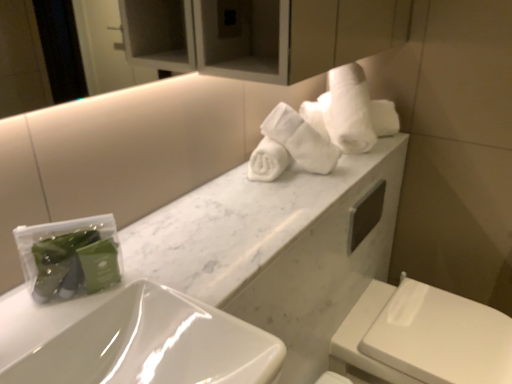
Question: Can you confirm if white soft towel at upper right is taller than white glossy sink at lower left?

Choices:
 (A) no
 (B) yes

Answer: (B)

Question: Considering the relative sizes of white soft towel at upper right and white glossy sink at lower left in the image provided, is white soft towel at upper right wider than white glossy sink at lower left?

Choices:
 (A) no
 (B) yes

Answer: (A)

Question: Does white soft towel at upper right touch white glossy sink at lower left?

Choices:
 (A) no
 (B) yes

Answer: (A)

Question: Is white soft towel at upper right oriented towards white glossy sink at lower left?

Choices:
 (A) yes
 (B) no

Answer: (B)

Question: Is white soft towel at upper right closer to the viewer compared to white glossy sink at lower left?

Choices:
 (A) no
 (B) yes

Answer: (A)

Question: From their relative heights in the image, would you say white glossy toilet at lower right is taller or shorter than white marble countertop at center?

Choices:
 (A) short
 (B) tall

Answer: (B)

Question: Based on their sizes in the image, would you say white glossy toilet at lower right is bigger or smaller than white marble countertop at center?

Choices:
 (A) small
 (B) big

Answer: (B)

Question: From the image's perspective, relative to white marble countertop at center, is white glossy toilet at lower right above or below?

Choices:
 (A) above
 (B) below

Answer: (B)

Question: From a real-world perspective, is white glossy toilet at lower right positioned above or below white marble countertop at center?

Choices:
 (A) below
 (B) above

Answer: (A)

Question: In terms of width, does white soft towel at upper right look wider or thinner when compared to white glossy toilet at lower right?

Choices:
 (A) thin
 (B) wide

Answer: (A)

Question: Does point (338, 127) appear closer or farther from the camera than point (382, 339)?

Choices:
 (A) closer
 (B) farther

Answer: (B)

Question: From the image's perspective, relative to white glossy toilet at lower right, is white soft towel at upper right above or below?

Choices:
 (A) below
 (B) above

Answer: (B)

Question: In terms of size, does white soft towel at upper right appear bigger or smaller than white glossy toilet at lower right?

Choices:
 (A) small
 (B) big

Answer: (A)

Question: Considering the positions of point (104, 302) and point (390, 115), is point (104, 302) closer or farther from the camera than point (390, 115)?

Choices:
 (A) closer
 (B) farther

Answer: (A)

Question: From a real-world perspective, relative to white soft towel at upper right, is white glossy sink at lower left vertically above or below?

Choices:
 (A) below
 (B) above

Answer: (A)